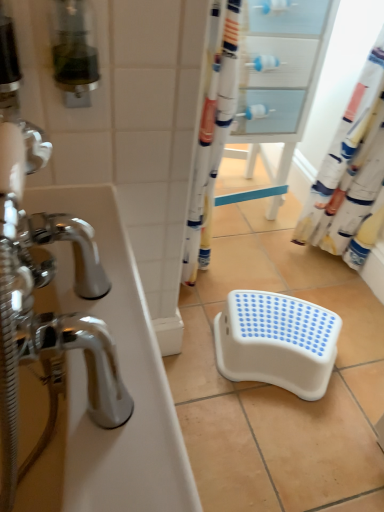
At what (x,y) coordinates should I click in order to perform the action: click on vacant space in front of white glossy drawer at upper center. Please return your answer as a coordinate pair (x, y). The image size is (384, 512). Looking at the image, I should click on pyautogui.click(x=263, y=253).